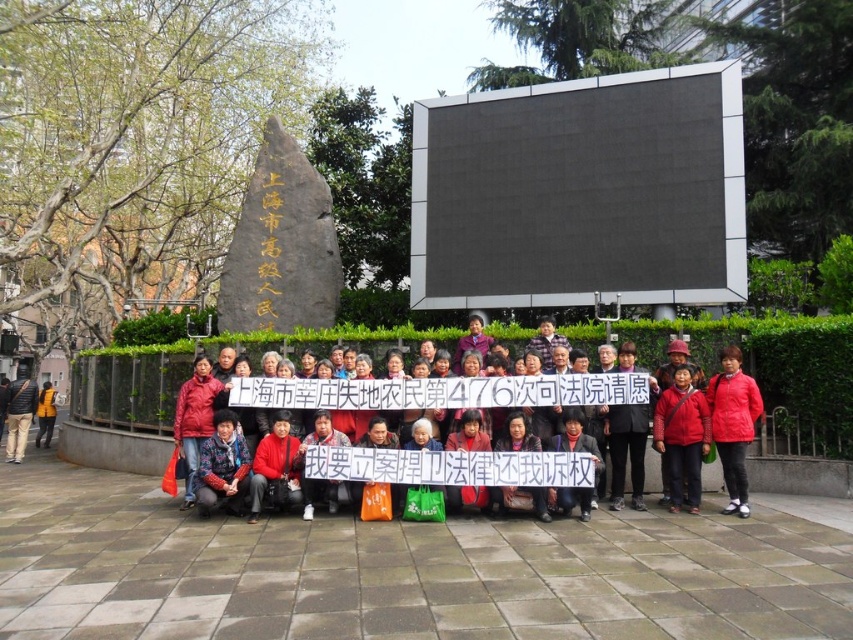
How much distance is there between red matte jacket at right and matte red jacket at center?

They are 14.38 meters apart.

Which of these two, red matte jacket at right or matte red jacket at center, stands taller?

With more height is red matte jacket at right.

Does point (730, 353) come farther from viewer compared to point (222, 404)?

No, (730, 353) is closer to viewer.

What are the coordinates of `red matte jacket at right` in the screenshot? It's located at (733, 424).

Is red fabric coat at center wider than yellow fabric jacket at lower left?

Correct, the width of red fabric coat at center exceeds that of yellow fabric jacket at lower left.

Does red fabric coat at center appear on the left side of yellow fabric jacket at lower left?

No, red fabric coat at center is not to the left of yellow fabric jacket at lower left.

This screenshot has height=640, width=853. Identify the location of red fabric coat at center. (447, 392).

Between point (732, 470) and point (42, 401), which one is positioned in front?

Point (732, 470) is more forward.

Who is more distant from viewer, (x=732, y=472) or (x=51, y=410)?

Positioned behind is point (x=51, y=410).

This screenshot has height=640, width=853. What do you see at coordinates (733, 424) in the screenshot?
I see `red matte jacket at right` at bounding box center [733, 424].

The image size is (853, 640). I want to click on red matte jacket at right, so pyautogui.click(x=733, y=424).